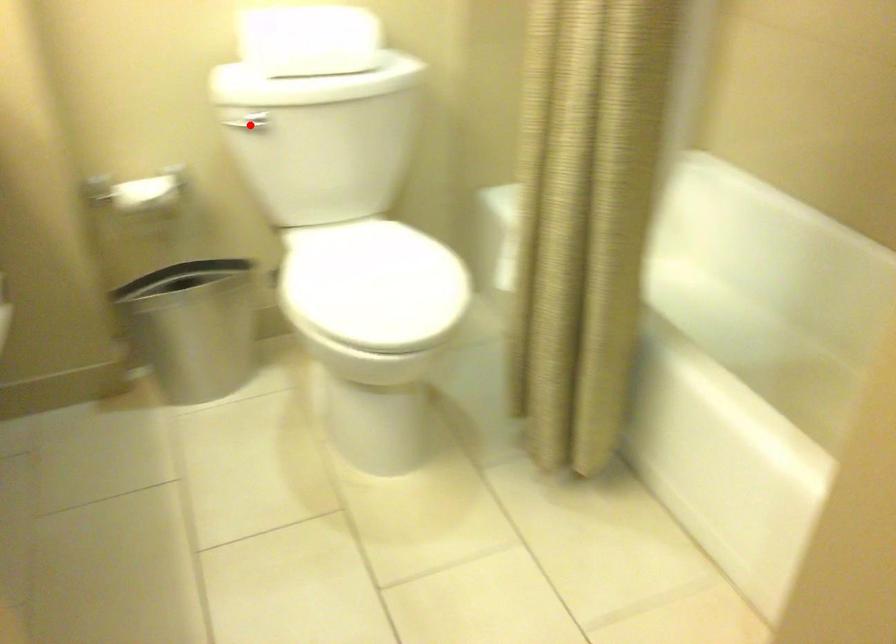
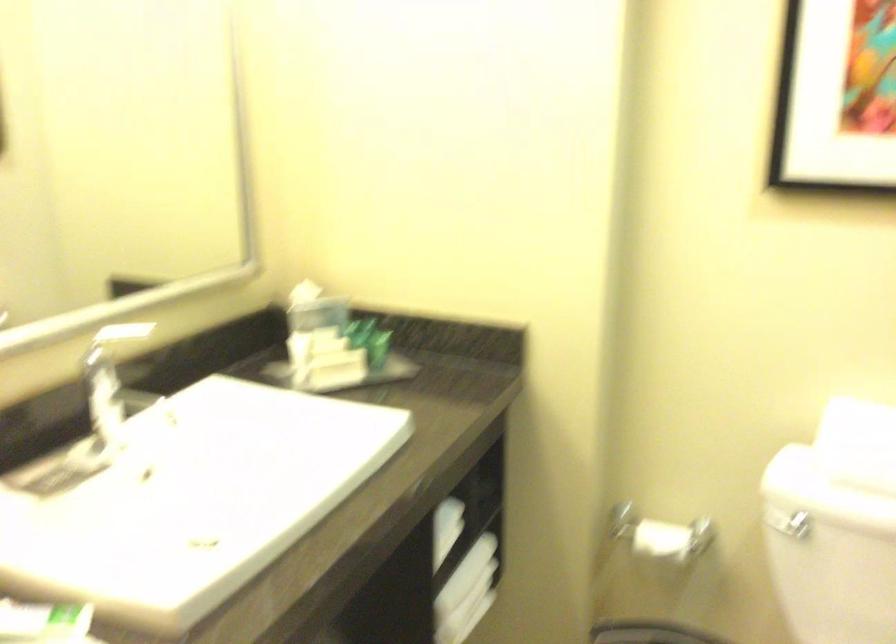
Question: I am providing you with two images of the same scene from different viewpoints. Image1 has a red point marked. In image2, the corresponding 3D location appears at what relative position? Reply with the corresponding letter.

Choices:
 (A) Closer
 (B) Farther

Answer: (A)